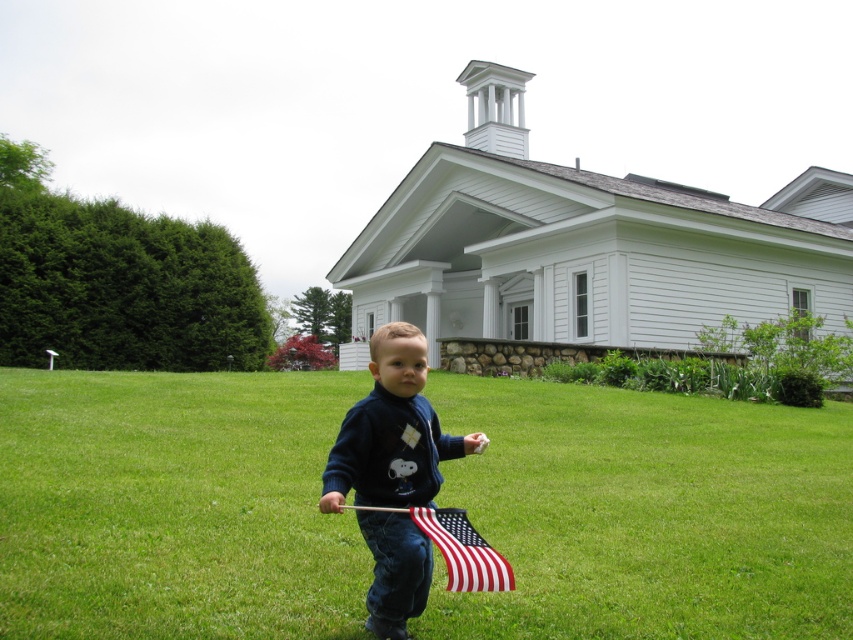
Question: Considering the relative positions of dark blue sweater at center and american flag at center in the image provided, where is dark blue sweater at center located with respect to american flag at center?

Choices:
 (A) below
 (B) above

Answer: (B)

Question: Does green grass at center appear under american flag at center?

Choices:
 (A) no
 (B) yes

Answer: (B)

Question: Can you confirm if dark blue sweater at center is positioned below american flag at center?

Choices:
 (A) yes
 (B) no

Answer: (B)

Question: Among these objects, which one is nearest to the camera?

Choices:
 (A) american flag at center
 (B) dark blue sweater at center

Answer: (A)

Question: Among these points, which one is nearest to the camera?

Choices:
 (A) (421, 520)
 (B) (242, 499)

Answer: (A)

Question: Among these points, which one is nearest to the camera?

Choices:
 (A) (416, 412)
 (B) (219, 522)
 (C) (495, 577)

Answer: (C)